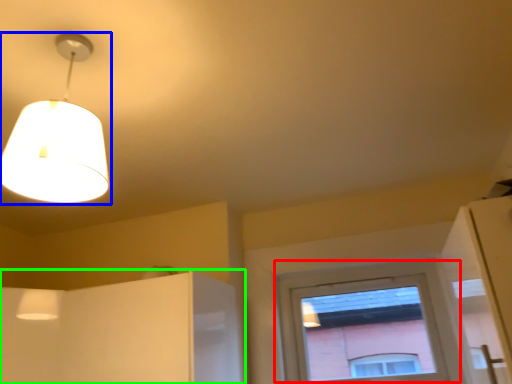
Question: Based on their relative distances, which object is farther from window (highlighted by a red box)? Choose from lamp (highlighted by a blue box) and cabinetry (highlighted by a green box).

Choices:
 (A) lamp
 (B) cabinetry

Answer: (A)